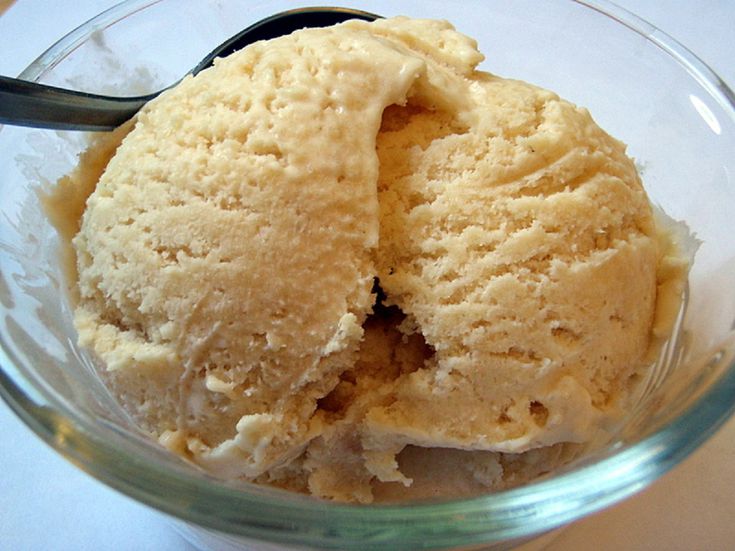
The image size is (735, 551). In order to click on glass in this screenshot , I will do `click(592, 499)`.